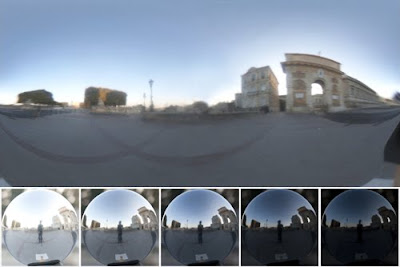
You are a GUI agent. You are given a task and a screenshot of the screen. Output one action in this format:
    pyautogui.click(x=<x>, y=<y>)
    Task: Click on the bright mirror
    The width and height of the screenshot is (400, 267).
    Given the screenshot: What is the action you would take?
    pyautogui.click(x=44, y=210)